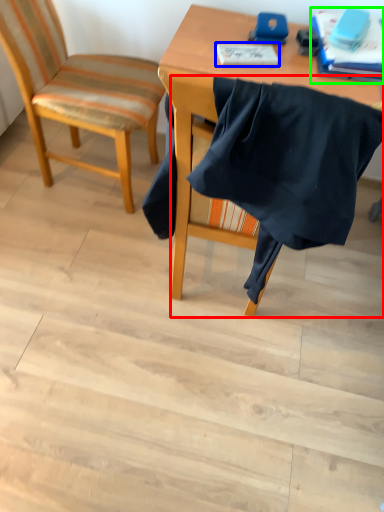
Question: Based on their relative distances, which object is nearer to chair (highlighted by a red box)? Choose from notebook (highlighted by a blue box) and book (highlighted by a green box).

Choices:
 (A) notebook
 (B) book

Answer: (A)